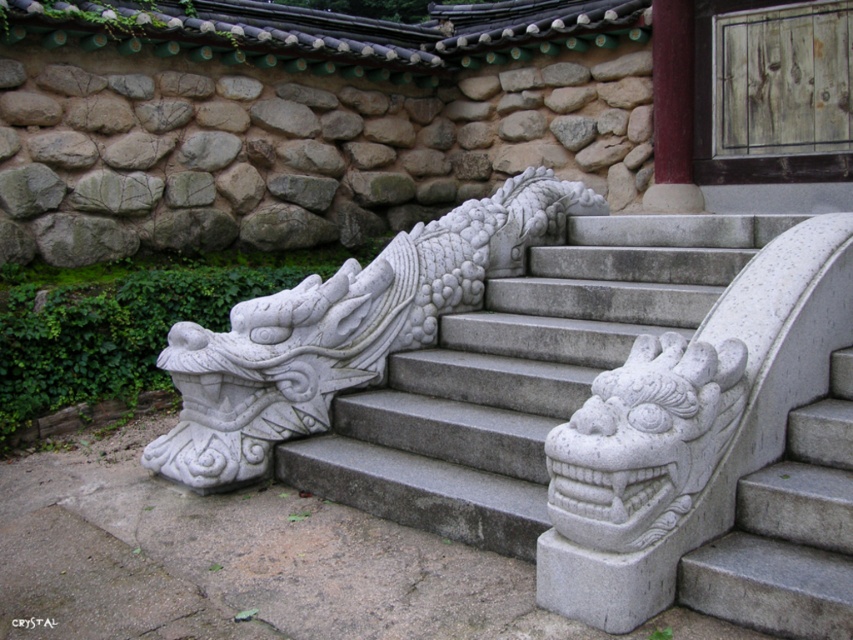
You are a delivery person with a cart that is 3 meters wide. You need to move through the gap between the gray stone stairs at center. Can your cart fit through the gap?

The gap between the gray stone stairs at center is 2.94 meters, which is narrower than the cart width of 3 meters. The cart cannot fit through the gap.

You are an architect designing a miniature model of this scene. The scale requires all objects to be reduced proportionally. If the white stone dragon head at upper right must be exactly 5 centimeters tall in the model, what should be the minimum height of the gray stone stairs at center to maintain the original size relationship?

The gray stone stairs at center is larger in size than the white stone dragon head at upper right. Since the dragon head must be 5 centimeters tall in the model, the stairs must be taller than 5 centimeters to maintain the original size relationship.

You are standing at the base of the traditional stone staircase with dragon head carvings. You want to take a photo of the point at coordinates (495, 204). If your camera has a focal length of 50mm and you are 5.09 meters away from the point, what is the required distance in meters between you and the point to ensure the point fills the frame vertically without cropping?

The point at coordinates (495, 204) is 5.09 meters away from the camera. To ensure the point fills the frame vertically without cropping, you need to adjust your distance based on the camera sensor size and field of view. However, without specific sensor dimensions, the exact distance cannot be calculated. The current distance is 5.09 meters.